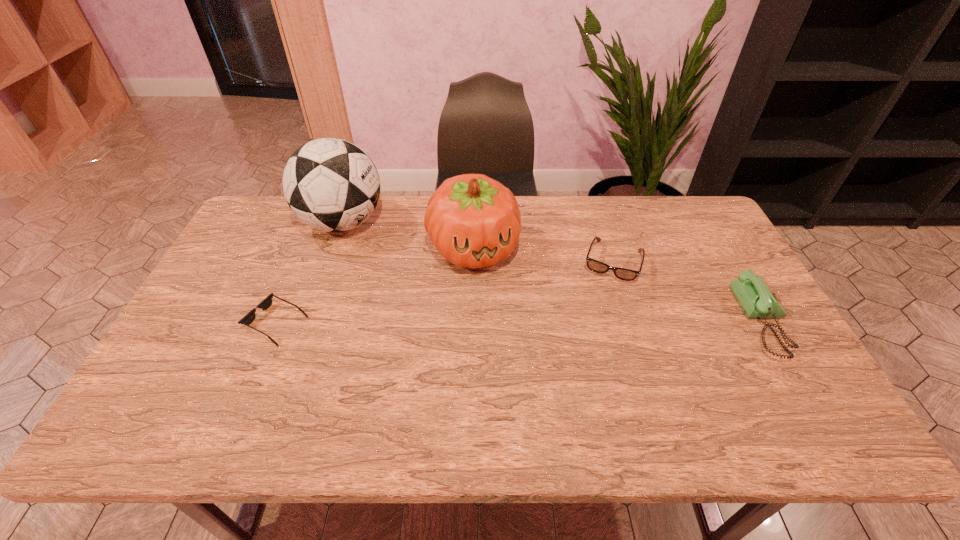
Where is `free space that satisfies the following two spatial constraints: 1. on the front side of the soccer ball; 2. on the dial of the third tallest object`? free space that satisfies the following two spatial constraints: 1. on the front side of the soccer ball; 2. on the dial of the third tallest object is located at coordinates (308, 321).